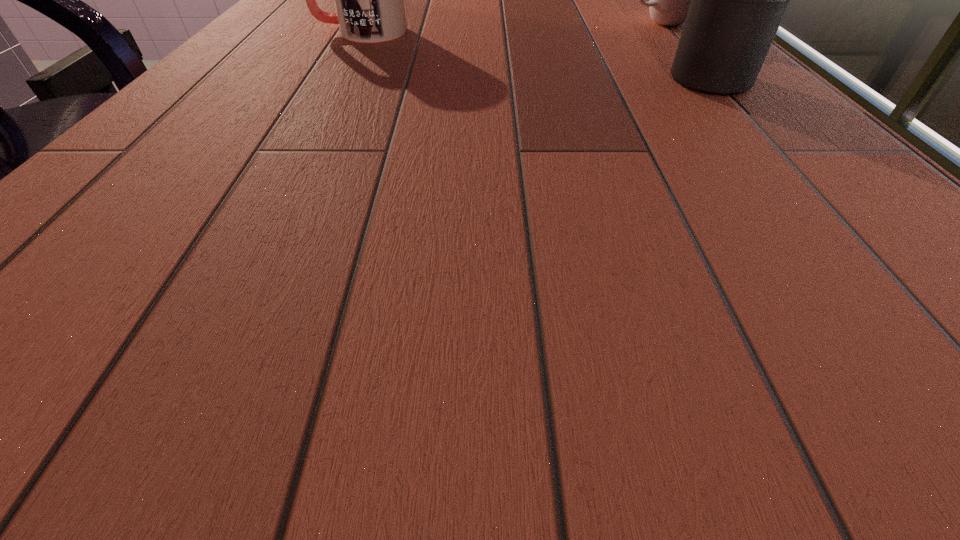
You are a GUI agent. You are given a task and a screenshot of the screen. Output one action in this format:
    pyautogui.click(x=<x>, y=<y>)
    Task: Click on the mug
    
    Given the screenshot: What is the action you would take?
    pyautogui.click(x=369, y=4)

Where is `the second tallest object`? The image size is (960, 540). the second tallest object is located at coordinates (369, 4).

Identify the location of the tallest object. (738, 0).

Where is `jar`? The width and height of the screenshot is (960, 540). jar is located at coordinates (738, 0).

The image size is (960, 540). Identify the location of cup. (669, 3).

The image size is (960, 540). Find the location of `vacant space located on the side of the second shortest object with the handle`. vacant space located on the side of the second shortest object with the handle is located at coordinates (284, 32).

Locate an element on the screen. vacant space located on the side of the second shortest object with the handle is located at coordinates (279, 32).

Where is `free space located on the side of the second shortest object with the handle`? This screenshot has height=540, width=960. free space located on the side of the second shortest object with the handle is located at coordinates (259, 32).

This screenshot has width=960, height=540. Identify the location of vacant space located with the handle on the side of the cup. (549, 36).

Locate an element on the screen. vacant region located 0.070m with the handle on the side of the cup is located at coordinates (598, 30).